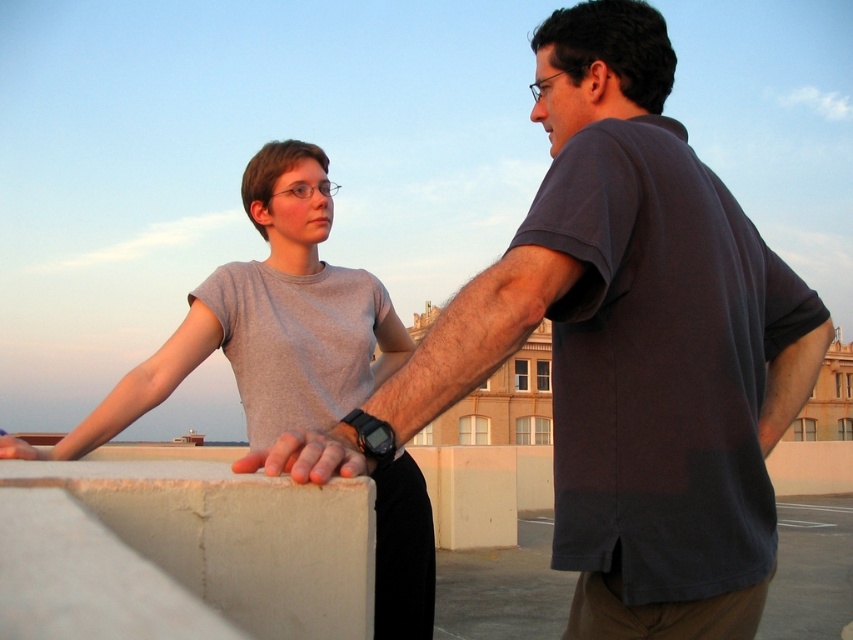
Based on the coordinates provided, which object is located at point (633, 346) in the image?

The point (633, 346) marks the location of the dark gray t shirt at center.